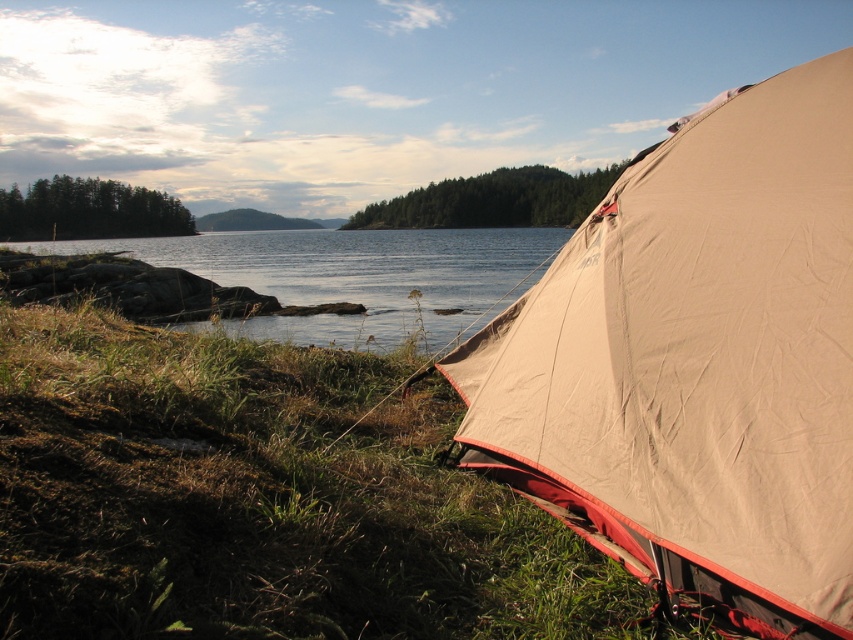
Question: Which point is farther from the camera taking this photo?

Choices:
 (A) (113, 237)
 (B) (469, 413)

Answer: (A)

Question: Which of the following is the farthest from the observer?

Choices:
 (A) beige canvas tent at lower right
 (B) clear water at lower left

Answer: (B)

Question: Does beige canvas tent at lower right appear under clear water at lower left?

Choices:
 (A) no
 (B) yes

Answer: (B)

Question: Does beige canvas tent at lower right have a lesser width compared to clear water at lower left?

Choices:
 (A) no
 (B) yes

Answer: (B)

Question: Which point appears farthest from the camera in this image?

Choices:
 (A) (724, 540)
 (B) (372, 257)

Answer: (B)

Question: Can you confirm if beige canvas tent at lower right is positioned above clear water at lower left?

Choices:
 (A) no
 (B) yes

Answer: (A)